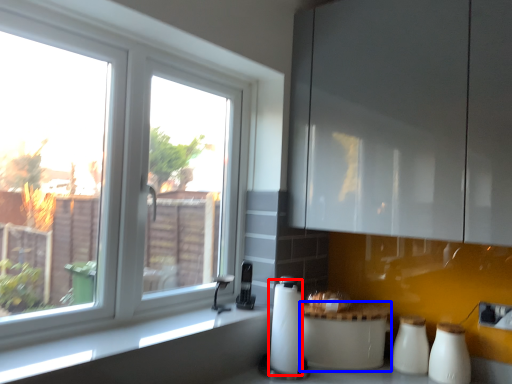
Question: Which of the following is the closest to the observer, paper towel (highlighted by a red box) or appliance (highlighted by a blue box)?

Choices:
 (A) paper towel
 (B) appliance

Answer: (A)